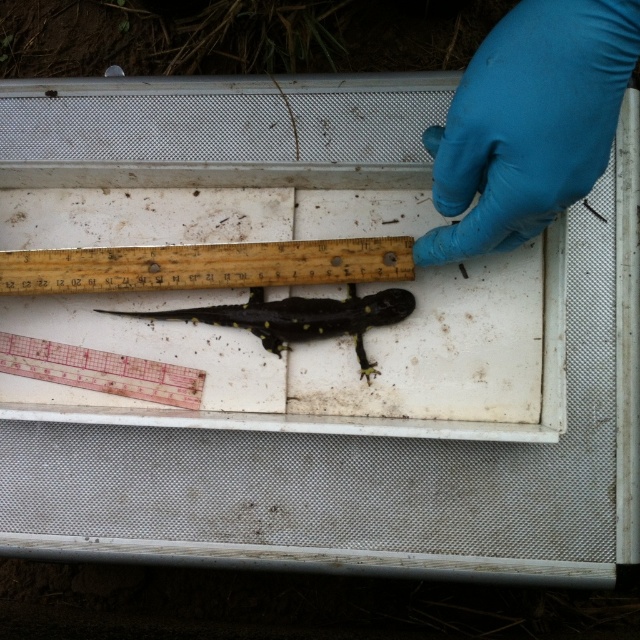
Question: Can you confirm if blue rubber glove at upper right is positioned to the right of black matte salamander at center?

Choices:
 (A) yes
 (B) no

Answer: (A)

Question: From the image, what is the correct spatial relationship of wooden ruler at center in relation to black matte salamander at center?

Choices:
 (A) right
 (B) left

Answer: (B)

Question: Among these points, which one is nearest to the camera?

Choices:
 (A) (592, 150)
 (B) (362, 266)
 (C) (136, 384)
 (D) (346, 320)

Answer: (A)

Question: Which point appears farthest from the camera in this image?

Choices:
 (A) (465, 100)
 (B) (19, 285)
 (C) (168, 387)

Answer: (C)

Question: Which object is the closest to the transparent plastic ruler at lower left?

Choices:
 (A) wooden ruler at center
 (B) black matte salamander at center

Answer: (B)

Question: Is blue rubber glove at upper right bigger than wooden ruler at center?

Choices:
 (A) yes
 (B) no

Answer: (A)